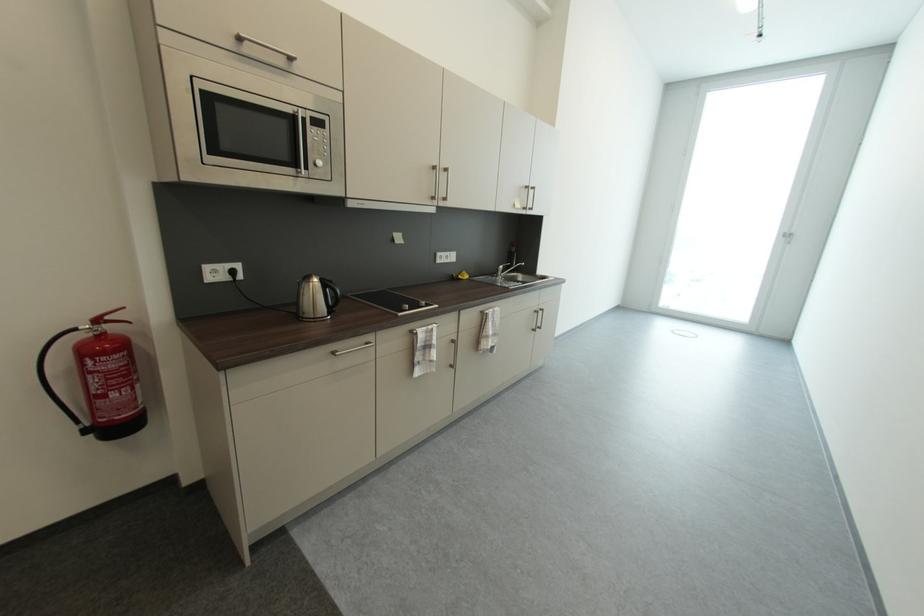
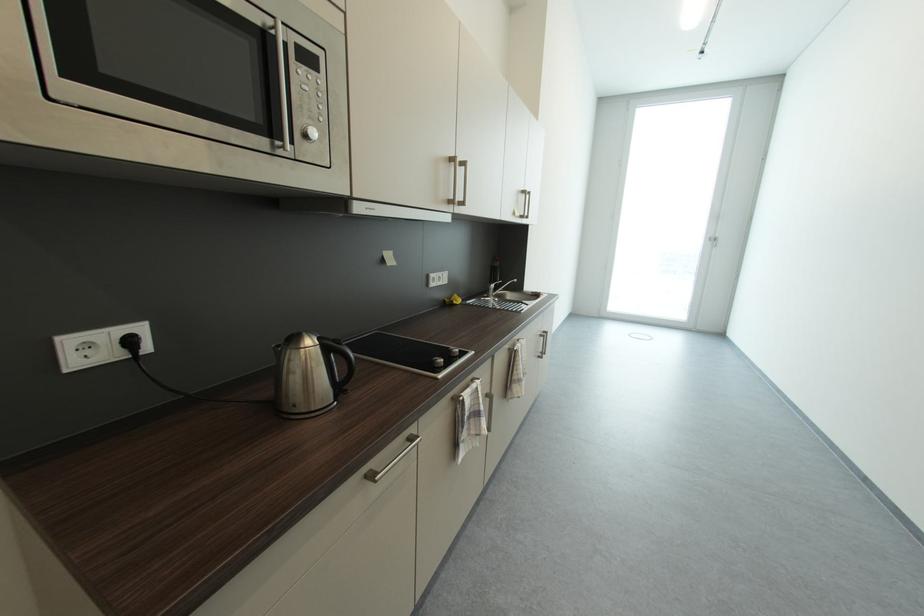
The point at [325,281] is marked in the first image. Where is the corresponding point in the second image?

(323, 342)